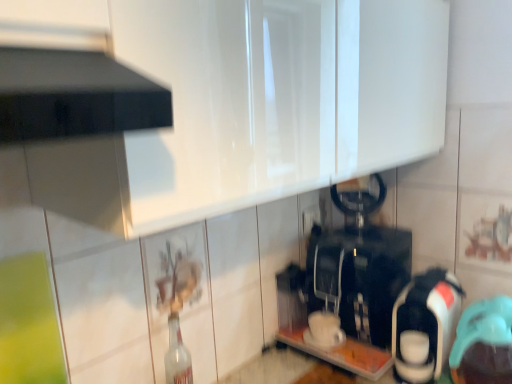
Measure the distance between clear glass bottle at center and camera.

clear glass bottle at center and camera are 3.60 feet apart.

Locate an element on the screen. This screenshot has width=512, height=384. teal rubber cap at lower right, positioned as the 1th appliance in right-to-left order is located at coordinates (484, 343).

The width and height of the screenshot is (512, 384). Describe the element at coordinates (358, 267) in the screenshot. I see `black plastic coffee machine at center, the first appliance viewed from the left` at that location.

Image resolution: width=512 pixels, height=384 pixels. I want to click on white glossy coffee maker at right, which ranks as the second appliance in left-to-right order, so click(425, 325).

Identify the location of clear glass bottle at center. The image size is (512, 384). (177, 355).

From the image's perspective, which object appears higher, black plastic coffee machine at center, the first appliance viewed from the left, or white glossy coffee maker at right, which ranks as the second appliance in left-to-right order?

black plastic coffee machine at center, the first appliance viewed from the left, from the image's perspective.

Considering the sizes of objects black plastic coffee machine at center, the first appliance viewed from the left, and white glossy coffee maker at right, which ranks as the second appliance in left-to-right order, in the image provided, who is shorter, black plastic coffee machine at center, the first appliance viewed from the left, or white glossy coffee maker at right, which ranks as the second appliance in left-to-right order,?

Standing shorter between the two is white glossy coffee maker at right, which ranks as the second appliance in left-to-right order.

Does point (375, 340) lie behind point (405, 309)?

Yes, it is.

From a real-world perspective, between white glossy coffee maker at right, which ranks as the second appliance in left-to-right order, and teal rubber cap at lower right, which is the 3th appliance in left-to-right order, who is vertically lower?

From a 3D spatial view, teal rubber cap at lower right, which is the 3th appliance in left-to-right order, is below.

Find the location of a particular element. appliance in front of the white glossy coffee maker at right, which ranks as the second appliance in left-to-right order is located at coordinates (484, 343).

Looking at their sizes, would you say white glossy coffee maker at right, which is the 2th appliance from right to left, is wider or thinner than teal rubber cap at lower right, positioned as the 1th appliance in right-to-left order?

Clearly, white glossy coffee maker at right, which is the 2th appliance from right to left, has more width compared to teal rubber cap at lower right, positioned as the 1th appliance in right-to-left order.

This screenshot has width=512, height=384. Identify the location of the 3rd appliance positioned above the clear glass bottle at center (from the image's perspective). (358, 267).

Can you tell me how much black plastic coffee machine at center, arranged as the 3th appliance when viewed from the right, and clear glass bottle at center differ in facing direction?

The facing directions of black plastic coffee machine at center, arranged as the 3th appliance when viewed from the right, and clear glass bottle at center are 90 degrees apart.

Is black plastic coffee machine at center, the first appliance viewed from the left, taller or shorter than clear glass bottle at center?

Clearly, black plastic coffee machine at center, the first appliance viewed from the left, is taller compared to clear glass bottle at center.

Is black plastic coffee machine at center, arranged as the 3th appliance when viewed from the right, positioned with its back to clear glass bottle at center?

No.

The image size is (512, 384). Identify the location of bottle on the left of teal rubber cap at lower right, positioned as the 1th appliance in right-to-left order. (177, 355).

Considering their positions, is clear glass bottle at center located in front of or behind teal rubber cap at lower right, which is the 3th appliance in left-to-right order?

Clearly, clear glass bottle at center is behind teal rubber cap at lower right, which is the 3th appliance in left-to-right order.

From the image's perspective, which object appears higher, clear glass bottle at center or teal rubber cap at lower right, which is the 3th appliance in left-to-right order?

From the image's view, teal rubber cap at lower right, which is the 3th appliance in left-to-right order, is above.

Is teal rubber cap at lower right, which is the 3th appliance in left-to-right order, in front of or behind clear glass bottle at center in the image?

Clearly, teal rubber cap at lower right, which is the 3th appliance in left-to-right order, is in front of clear glass bottle at center.

How many degrees apart are the facing directions of teal rubber cap at lower right, which is the 3th appliance in left-to-right order, and clear glass bottle at center?

90 degrees.

Is the surface of teal rubber cap at lower right, which is the 3th appliance in left-to-right order, in direct contact with clear glass bottle at center?

teal rubber cap at lower right, which is the 3th appliance in left-to-right order, is not next to clear glass bottle at center, and they're not touching.

From a real-world perspective, is teal rubber cap at lower right, which is the 3th appliance in left-to-right order, beneath clear glass bottle at center?

Correct, in the physical world, teal rubber cap at lower right, which is the 3th appliance in left-to-right order, is lower than clear glass bottle at center.

Is teal rubber cap at lower right, which is the 3th appliance in left-to-right order, turned away from white glossy coffee maker at right, which is the 2th appliance from right to left?

Result: That's not correct — teal rubber cap at lower right, which is the 3th appliance in left-to-right order, is not looking away from white glossy coffee maker at right, which is the 2th appliance from right to left.

Can white glossy coffee maker at right, which is the 2th appliance from right to left, be found inside teal rubber cap at lower right, which is the 3th appliance in left-to-right order?

Actually, white glossy coffee maker at right, which is the 2th appliance from right to left, is outside teal rubber cap at lower right, which is the 3th appliance in left-to-right order.

Find the location of a particular element. The width and height of the screenshot is (512, 384). the 1st appliance counting from the left of the teal rubber cap at lower right, positioned as the 1th appliance in right-to-left order is located at coordinates (425, 325).

Is white glossy coffee maker at right, which ranks as the second appliance in left-to-right order, positioned with its back to black plastic coffee machine at center, arranged as the 3th appliance when viewed from the right?

No, black plastic coffee machine at center, arranged as the 3th appliance when viewed from the right, is not at the back of white glossy coffee maker at right, which ranks as the second appliance in left-to-right order.

From a real-world perspective, is white glossy coffee maker at right, which ranks as the second appliance in left-to-right order, positioned under black plastic coffee machine at center, arranged as the 3th appliance when viewed from the right, based on gravity?

Yes, from a real-world perspective, white glossy coffee maker at right, which ranks as the second appliance in left-to-right order, is under black plastic coffee machine at center, arranged as the 3th appliance when viewed from the right.

Considering the relative sizes of white glossy coffee maker at right, which is the 2th appliance from right to left, and black plastic coffee machine at center, the first appliance viewed from the left, in the image provided, is white glossy coffee maker at right, which is the 2th appliance from right to left, smaller than black plastic coffee machine at center, the first appliance viewed from the left,?

Yes, white glossy coffee maker at right, which is the 2th appliance from right to left, is smaller than black plastic coffee machine at center, the first appliance viewed from the left.

Considering the relative sizes of white glossy coffee maker at right, which ranks as the second appliance in left-to-right order, and black plastic coffee machine at center, the first appliance viewed from the left, in the image provided, is white glossy coffee maker at right, which ranks as the second appliance in left-to-right order, shorter than black plastic coffee machine at center, the first appliance viewed from the left,?

Indeed, white glossy coffee maker at right, which ranks as the second appliance in left-to-right order, has a lesser height compared to black plastic coffee machine at center, the first appliance viewed from the left.

In order to click on appliance behind the white glossy coffee maker at right, which is the 2th appliance from right to left in this screenshot , I will do `click(358, 267)`.

Where is `the 1st appliance to the left of the teal rubber cap at lower right, positioned as the 1th appliance in right-to-left order, counting from the anchor's position`? the 1st appliance to the left of the teal rubber cap at lower right, positioned as the 1th appliance in right-to-left order, counting from the anchor's position is located at coordinates (425, 325).

Estimate the real-world distances between objects in this image. Which object is closer to clear glass bottle at center, black plastic coffee machine at center, the first appliance viewed from the left, or teal rubber cap at lower right, which is the 3th appliance in left-to-right order?

Among the two, black plastic coffee machine at center, the first appliance viewed from the left, is located nearer to clear glass bottle at center.

Which object lies nearer to the anchor point white glossy coffee maker at right, which is the 2th appliance from right to left, black plastic coffee machine at center, the first appliance viewed from the left, or clear glass bottle at center?

black plastic coffee machine at center, the first appliance viewed from the left, is positioned closer to the anchor white glossy coffee maker at right, which is the 2th appliance from right to left.

Which object lies further to the anchor point black plastic coffee machine at center, arranged as the 3th appliance when viewed from the right, white glossy coffee maker at right, which ranks as the second appliance in left-to-right order, or teal rubber cap at lower right, which is the 3th appliance in left-to-right order?

The object further to black plastic coffee machine at center, arranged as the 3th appliance when viewed from the right, is teal rubber cap at lower right, which is the 3th appliance in left-to-right order.

Considering their positions, is white glossy coffee maker at right, which ranks as the second appliance in left-to-right order, positioned further to clear glass bottle at center than teal rubber cap at lower right, which is the 3th appliance in left-to-right order?

The object further to clear glass bottle at center is teal rubber cap at lower right, which is the 3th appliance in left-to-right order.

Estimate the real-world distances between objects in this image. Which object is closer to clear glass bottle at center, white glossy coffee maker at right, which is the 2th appliance from right to left, or black plastic coffee machine at center, arranged as the 3th appliance when viewed from the right?

black plastic coffee machine at center, arranged as the 3th appliance when viewed from the right, is positioned closer to the anchor clear glass bottle at center.

Considering their positions, is clear glass bottle at center positioned further to black plastic coffee machine at center, arranged as the 3th appliance when viewed from the right, than teal rubber cap at lower right, positioned as the 1th appliance in right-to-left order?

clear glass bottle at center lies further to black plastic coffee machine at center, arranged as the 3th appliance when viewed from the right, than the other object.

Which object lies nearer to the anchor point black plastic coffee machine at center, arranged as the 3th appliance when viewed from the right, clear glass bottle at center or white glossy coffee maker at right, which ranks as the second appliance in left-to-right order?

Based on the image, white glossy coffee maker at right, which ranks as the second appliance in left-to-right order, appears to be nearer to black plastic coffee machine at center, arranged as the 3th appliance when viewed from the right.

Based on their spatial positions, is black plastic coffee machine at center, the first appliance viewed from the left, or white glossy coffee maker at right, which ranks as the second appliance in left-to-right order, closer to teal rubber cap at lower right, which is the 3th appliance in left-to-right order?

Based on the image, white glossy coffee maker at right, which ranks as the second appliance in left-to-right order, appears to be nearer to teal rubber cap at lower right, which is the 3th appliance in left-to-right order.

Locate an element on the screen. appliance between black plastic coffee machine at center, arranged as the 3th appliance when viewed from the right, and teal rubber cap at lower right, positioned as the 1th appliance in right-to-left order, in the horizontal direction is located at coordinates (425, 325).

Image resolution: width=512 pixels, height=384 pixels. In order to click on appliance between clear glass bottle at center and white glossy coffee maker at right, which ranks as the second appliance in left-to-right order, in the horizontal direction in this screenshot , I will do `click(358, 267)`.